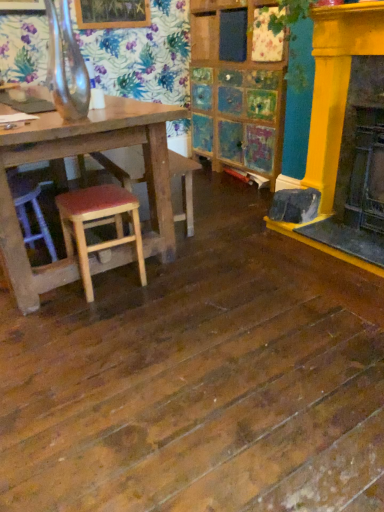
Where is `free location in front of wooden seat at center`? This screenshot has height=512, width=384. free location in front of wooden seat at center is located at coordinates (174, 303).